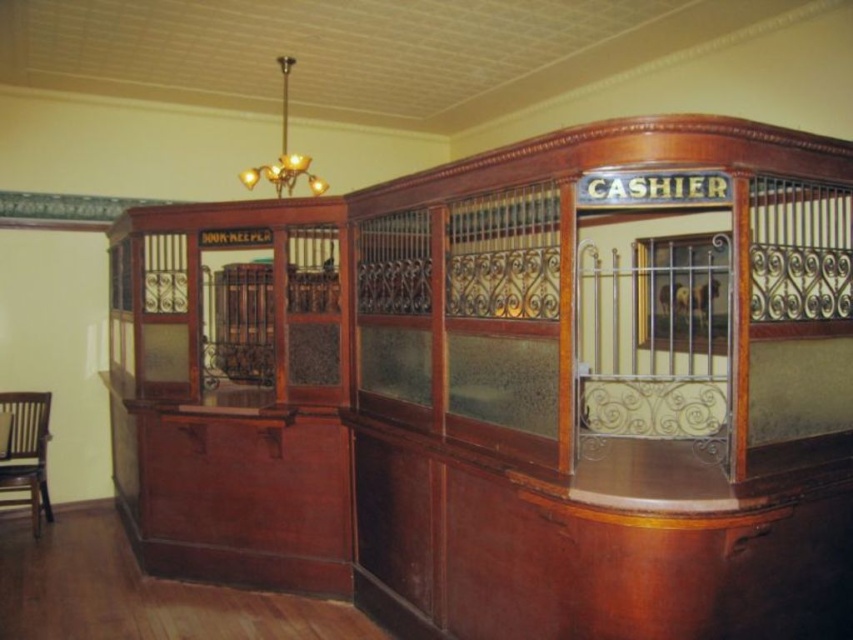
You are standing in front of the vintage cashier booth and notice two points marked on the booth. The first point is at coordinate point [0,467] and the second is at point [271,172]. From your perspective, which point is closer to you?

Point [271,172] is closer to you because according to the description, point [0,467] is behind point [271,172].

Based on the photo, you are designing a layout for a new vintage cafe and want to ensure there is enough space for both the wooden chair at lower left and the gold metallic chandelier at upper center. Based on their sizes, which object takes up more space in the booth?

The gold metallic chandelier at upper center occupies more space than the wooden chair at lower left, as stated in the description.